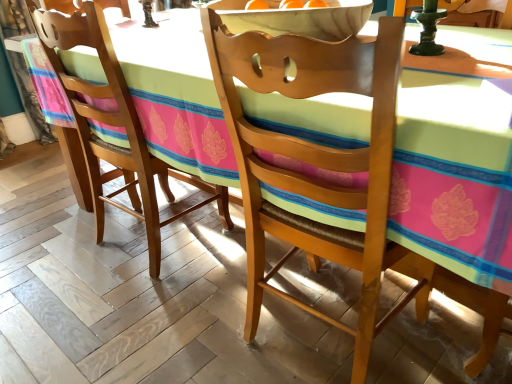
Question: Does wooden chair at center, the 1th chair viewed from the right, turn towards matte wood chair at lower left, the 2th chair in the right-to-left sequence?

Choices:
 (A) no
 (B) yes

Answer: (A)

Question: Is wooden chair at center, the 1th chair viewed from the right, at the left side of matte wood chair at lower left, acting as the first chair starting from the left?

Choices:
 (A) no
 (B) yes

Answer: (A)

Question: From a real-world perspective, is wooden chair at center, the 2th chair viewed from the left, located higher than matte wood chair at lower left, acting as the first chair starting from the left?

Choices:
 (A) no
 (B) yes

Answer: (A)

Question: Does wooden chair at center, the 2th chair viewed from the left, have a greater width compared to matte wood chair at lower left, the 2th chair in the right-to-left sequence?

Choices:
 (A) no
 (B) yes

Answer: (A)

Question: Does wooden chair at center, the 1th chair viewed from the right, have a smaller size compared to matte wood chair at lower left, the 2th chair in the right-to-left sequence?

Choices:
 (A) yes
 (B) no

Answer: (A)

Question: From a real-world perspective, is wooden chair at center, the 1th chair viewed from the right, located beneath matte wood chair at lower left, the 2th chair in the right-to-left sequence?

Choices:
 (A) yes
 (B) no

Answer: (A)

Question: Would you consider matte wood chair at lower left, acting as the first chair starting from the left, to be distant from wooden chair at center, the 2th chair viewed from the left?

Choices:
 (A) yes
 (B) no

Answer: (B)

Question: Is matte wood chair at lower left, the 2th chair in the right-to-left sequence, thinner than wooden chair at center, the 2th chair viewed from the left?

Choices:
 (A) yes
 (B) no

Answer: (B)

Question: From a real-world perspective, is matte wood chair at lower left, the 2th chair in the right-to-left sequence, over wooden chair at center, the 2th chair viewed from the left?

Choices:
 (A) no
 (B) yes

Answer: (B)

Question: Is the position of matte wood chair at lower left, the 2th chair in the right-to-left sequence, more distant than that of wooden chair at center, the 1th chair viewed from the right?

Choices:
 (A) no
 (B) yes

Answer: (B)

Question: Is matte wood chair at lower left, acting as the first chair starting from the left, wider than wooden chair at center, the 2th chair viewed from the left?

Choices:
 (A) yes
 (B) no

Answer: (A)

Question: Is the surface of matte wood chair at lower left, the 2th chair in the right-to-left sequence, in direct contact with wooden chair at center, the 2th chair viewed from the left?

Choices:
 (A) yes
 (B) no

Answer: (B)

Question: Is wooden chair at center, the 2th chair viewed from the left, inside or outside of matte wood chair at lower left, the 2th chair in the right-to-left sequence?

Choices:
 (A) outside
 (B) inside

Answer: (A)